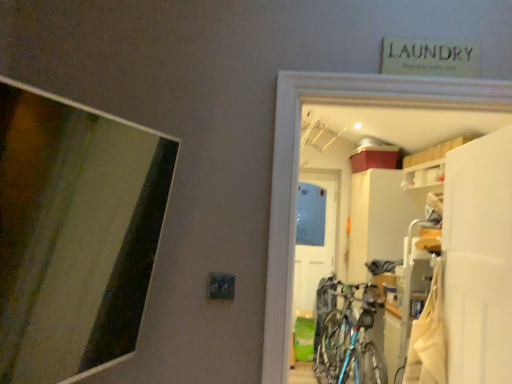
Question: Is white matte screen door at right bigger or smaller than blue metallic bicycle at center?

Choices:
 (A) big
 (B) small

Answer: (B)

Question: Is white matte screen door at right to the left or to the right of blue metallic bicycle at center in the image?

Choices:
 (A) left
 (B) right

Answer: (B)

Question: Based on their relative distances, which object is nearer to the white matte screen door at right?

Choices:
 (A) white matte door at center
 (B) blue metallic bicycle at center
 (C) white matte cabinet at upper right
 (D) metallic bicycle at center
 (E) white fabric laundry at lower right

Answer: (E)

Question: Which object is the closest to the white matte door at center?

Choices:
 (A) white matte screen door at right
 (B) metallic bicycle at center
 (C) white matte cabinet at upper right
 (D) blue metallic bicycle at center
 (E) white fabric laundry at lower right

Answer: (D)